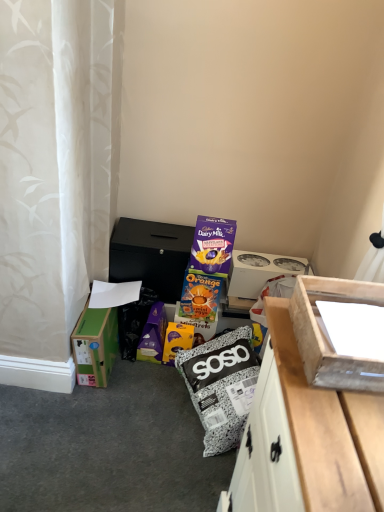
The height and width of the screenshot is (512, 384). Describe the element at coordinates (95, 345) in the screenshot. I see `green cardboard box at lower left, which appears as the 2th box when viewed from the front` at that location.

What do you see at coordinates (176, 341) in the screenshot? I see `orange cardboard box at center, which is counted as the 2th cardboard box, starting from the top` at bounding box center [176, 341].

At what (x,y) coordinates should I click in order to perform the action: click on green cardboard box at lower left, which appears as the second box when viewed from the back. Please return your answer as a coordinate pair (x, y). Looking at the image, I should click on pos(95,345).

Who is shorter, white cardboard box at upper right, which is the 3th box from front to back, or green cardboard box at lower left, which appears as the 2th box when viewed from the front?

Answer: white cardboard box at upper right, which is the 3th box from front to back.

From the image's perspective, which one is positioned lower, white cardboard box at upper right, marked as the 3th box in a left-to-right arrangement, or green cardboard box at lower left, which appears as the 3th box when viewed from the right?

green cardboard box at lower left, which appears as the 3th box when viewed from the right, appears lower in the image.

Is white cardboard box at upper right, which is the 3th box from front to back, oriented away from green cardboard box at lower left, which appears as the 2th box when viewed from the front?

No, green cardboard box at lower left, which appears as the 2th box when viewed from the front, is not at the back of white cardboard box at upper right, which is the 3th box from front to back.

There is a green cardboard box at lower left, the first box viewed from the left. At what (x,y) coordinates should I click in order to perform the action: click on the 2nd box above it (from the image's perspective). Please return your answer as a coordinate pair (x, y). The height and width of the screenshot is (512, 384). Looking at the image, I should click on (260, 271).

Is green cardboard box at lower left, which appears as the second box when viewed from the back, outside of orange cardboard box at center, the first cardboard box in the bottom-to-top sequence?

That's correct, green cardboard box at lower left, which appears as the second box when viewed from the back, is outside of orange cardboard box at center, the first cardboard box in the bottom-to-top sequence.

Does green cardboard box at lower left, which appears as the 2th box when viewed from the front, turn towards orange cardboard box at center, which is counted as the 2th cardboard box, starting from the top?

Yes, green cardboard box at lower left, which appears as the 2th box when viewed from the front, is facing orange cardboard box at center, which is counted as the 2th cardboard box, starting from the top.

Are green cardboard box at lower left, which appears as the second box when viewed from the back, and orange cardboard box at center, the first cardboard box in the bottom-to-top sequence, far apart?

No, green cardboard box at lower left, which appears as the second box when viewed from the back, is in close proximity to orange cardboard box at center, the first cardboard box in the bottom-to-top sequence.

Considering the positions of objects green cardboard box at lower left, the first box viewed from the left, and orange cardboard box at center, the first cardboard box in the bottom-to-top sequence, in the image provided, who is more to the left, green cardboard box at lower left, the first box viewed from the left, or orange cardboard box at center, the first cardboard box in the bottom-to-top sequence,?

green cardboard box at lower left, the first box viewed from the left.

In the scene shown: Is wooden box at right, arranged as the 1th box when viewed from the front, smaller than green cardboard box at lower left, which appears as the 3th box when viewed from the right?

Indeed, wooden box at right, arranged as the 1th box when viewed from the front, has a smaller size compared to green cardboard box at lower left, which appears as the 3th box when viewed from the right.

From a real-world perspective, between wooden box at right, which is counted as the second box, starting from the left, and green cardboard box at lower left, which appears as the 2th box when viewed from the front, who is vertically lower?

green cardboard box at lower left, which appears as the 2th box when viewed from the front, is physically lower.

From the image's perspective, which object appears higher, wooden box at right, arranged as the 1th box when viewed from the front, or green cardboard box at lower left, which appears as the second box when viewed from the back?

wooden box at right, arranged as the 1th box when viewed from the front, appears higher in the image.

Consider the image. Which of these two, wooden box at right, arranged as the second box when viewed from the right, or green cardboard box at lower left, which appears as the 2th box when viewed from the front, stands taller?

green cardboard box at lower left, which appears as the 2th box when viewed from the front, is taller.

From the image's perspective, is black matte box at center, marked as the first cardboard box in a top-to-bottom arrangement, located beneath green cardboard box at lower left, the first box viewed from the left?

No, from the image's perspective, black matte box at center, marked as the first cardboard box in a top-to-bottom arrangement, is not beneath green cardboard box at lower left, the first box viewed from the left.

How much distance is there between black matte box at center, the second cardboard box from the bottom, and green cardboard box at lower left, which appears as the 3th box when viewed from the right?

black matte box at center, the second cardboard box from the bottom, and green cardboard box at lower left, which appears as the 3th box when viewed from the right, are 29.92 centimeters apart.

Between black matte box at center, the second cardboard box from the bottom, and green cardboard box at lower left, the first box viewed from the left, which one appears on the right side from the viewer's perspective?

black matte box at center, the second cardboard box from the bottom.

Is black matte box at center, the second cardboard box from the bottom, located outside green cardboard box at lower left, which appears as the 3th box when viewed from the right?

Absolutely, black matte box at center, the second cardboard box from the bottom, is external to green cardboard box at lower left, which appears as the 3th box when viewed from the right.

From a real-world perspective, is green cardboard box at lower left, which appears as the 2th box when viewed from the front, on black matte box at center, marked as the first cardboard box in a top-to-bottom arrangement?

No.

Considering the relative sizes of green cardboard box at lower left, which appears as the second box when viewed from the back, and black matte box at center, marked as the first cardboard box in a top-to-bottom arrangement, in the image provided, is green cardboard box at lower left, which appears as the second box when viewed from the back, smaller than black matte box at center, marked as the first cardboard box in a top-to-bottom arrangement,?

Yes.

How much distance is there between green cardboard box at lower left, the first box viewed from the left, and black matte box at center, the second cardboard box from the bottom?

A distance of 29.92 centimeters exists between green cardboard box at lower left, the first box viewed from the left, and black matte box at center, the second cardboard box from the bottom.

Is green cardboard box at lower left, which appears as the 2th box when viewed from the front, positioned in front of black matte box at center, marked as the first cardboard box in a top-to-bottom arrangement?

Yes, green cardboard box at lower left, which appears as the 2th box when viewed from the front, is in front of black matte box at center, marked as the first cardboard box in a top-to-bottom arrangement.

Does point (266, 266) lie behind point (184, 331)?

Yes, it is.

Is white cardboard box at upper right, marked as the 3th box in a left-to-right arrangement, inside the boundaries of orange cardboard box at center, which is counted as the 2th cardboard box, starting from the top, or outside?

white cardboard box at upper right, marked as the 3th box in a left-to-right arrangement, is not inside orange cardboard box at center, which is counted as the 2th cardboard box, starting from the top, it's outside.

Considering the sizes of objects white cardboard box at upper right, marked as the 3th box in a left-to-right arrangement, and orange cardboard box at center, the first cardboard box in the bottom-to-top sequence, in the image provided, who is smaller, white cardboard box at upper right, marked as the 3th box in a left-to-right arrangement, or orange cardboard box at center, the first cardboard box in the bottom-to-top sequence,?

With smaller size is orange cardboard box at center, the first cardboard box in the bottom-to-top sequence.

Considering the relative positions of white cardboard box at upper right, marked as the 3th box in a left-to-right arrangement, and orange cardboard box at center, the first cardboard box in the bottom-to-top sequence, in the image provided, is white cardboard box at upper right, marked as the 3th box in a left-to-right arrangement, to the left or to the right of orange cardboard box at center, the first cardboard box in the bottom-to-top sequence,?

white cardboard box at upper right, marked as the 3th box in a left-to-right arrangement, is to the right of orange cardboard box at center, the first cardboard box in the bottom-to-top sequence.

Consider the image. Is wooden box at right, which is counted as the second box, starting from the left, positioned beyond the bounds of white cardboard box at upper right, which is the 3th box from front to back?

That's correct, wooden box at right, which is counted as the second box, starting from the left, is outside of white cardboard box at upper right, which is the 3th box from front to back.

Considering the sizes of objects wooden box at right, the 3th box positioned from the back, and white cardboard box at upper right, marked as the 3th box in a left-to-right arrangement, in the image provided, who is taller, wooden box at right, the 3th box positioned from the back, or white cardboard box at upper right, marked as the 3th box in a left-to-right arrangement,?

white cardboard box at upper right, marked as the 3th box in a left-to-right arrangement.

Which point is more forward, (341,382) or (245,283)?

Point (341,382)

In order to click on box that is under the white cardboard box at upper right, marked as the 3th box in a left-to-right arrangement (from a real-world perspective) in this screenshot , I will do `click(95, 345)`.

The width and height of the screenshot is (384, 512). Find the location of `box that is the 1st object located above the orange cardboard box at center, which is counted as the 2th cardboard box, starting from the top (from the image's perspective)`. box that is the 1st object located above the orange cardboard box at center, which is counted as the 2th cardboard box, starting from the top (from the image's perspective) is located at coordinates (95, 345).

Looking at the image, which one is located closer to orange cardboard box at center, which is counted as the 2th cardboard box, starting from the top, black matte box at center, marked as the first cardboard box in a top-to-bottom arrangement, or green cardboard box at lower left, which appears as the 2th box when viewed from the front?

Among the two, green cardboard box at lower left, which appears as the 2th box when viewed from the front, is located nearer to orange cardboard box at center, which is counted as the 2th cardboard box, starting from the top.

From the image, which object appears to be farther from wooden box at right, arranged as the second box when viewed from the right, white cardboard box at upper right, which is the 1th box from back to front, or black matte box at center, the second cardboard box from the bottom?

Among the two, white cardboard box at upper right, which is the 1th box from back to front, is located further to wooden box at right, arranged as the second box when viewed from the right.

Which object lies further to the anchor point wooden box at right, the 3th box positioned from the back, green cardboard box at lower left, which appears as the 2th box when viewed from the front, or black matte box at center, the second cardboard box from the bottom?

green cardboard box at lower left, which appears as the 2th box when viewed from the front, is further to wooden box at right, the 3th box positioned from the back.

Based on the photo, from the image, which object appears to be nearer to green cardboard box at lower left, which appears as the 3th box when viewed from the right, black matte box at center, the second cardboard box from the bottom, or wooden box at right, arranged as the 1th box when viewed from the front?

Among the two, black matte box at center, the second cardboard box from the bottom, is located nearer to green cardboard box at lower left, which appears as the 3th box when viewed from the right.

Which object lies further to the anchor point black matte box at center, marked as the first cardboard box in a top-to-bottom arrangement, green cardboard box at lower left, which appears as the 3th box when viewed from the right, or orange cardboard box at center, the first cardboard box in the bottom-to-top sequence?

The object further to black matte box at center, marked as the first cardboard box in a top-to-bottom arrangement, is orange cardboard box at center, the first cardboard box in the bottom-to-top sequence.

From the picture: Looking at the image, which one is located further to black matte box at center, the second cardboard box from the bottom, orange cardboard box at center, which is counted as the 2th cardboard box, starting from the top, or green cardboard box at lower left, which appears as the 3th box when viewed from the right?

The object further to black matte box at center, the second cardboard box from the bottom, is orange cardboard box at center, which is counted as the 2th cardboard box, starting from the top.

When comparing their distances from black matte box at center, marked as the first cardboard box in a top-to-bottom arrangement, does green cardboard box at lower left, which appears as the 3th box when viewed from the right, or wooden box at right, which is counted as the second box, starting from the left, seem closer?

Among the two, green cardboard box at lower left, which appears as the 3th box when viewed from the right, is located nearer to black matte box at center, marked as the first cardboard box in a top-to-bottom arrangement.

From the image, which object appears to be farther from orange cardboard box at center, the first cardboard box in the bottom-to-top sequence, black matte box at center, marked as the first cardboard box in a top-to-bottom arrangement, or white cardboard box at upper right, marked as the 3th box in a left-to-right arrangement?

white cardboard box at upper right, marked as the 3th box in a left-to-right arrangement, is positioned further to the anchor orange cardboard box at center, the first cardboard box in the bottom-to-top sequence.

Find the location of a particular element. box positioned between wooden box at right, arranged as the second box when viewed from the right, and orange cardboard box at center, the first cardboard box in the bottom-to-top sequence, from near to far is located at coordinates (95, 345).

Find the location of a particular element. Image resolution: width=384 pixels, height=512 pixels. cardboard box situated between black matte box at center, the second cardboard box from the bottom, and white cardboard box at upper right, marked as the 3th box in a left-to-right arrangement, from left to right is located at coordinates (176, 341).

Locate an element on the screen. The width and height of the screenshot is (384, 512). box between wooden box at right, arranged as the second box when viewed from the right, and white cardboard box at upper right, marked as the 3th box in a left-to-right arrangement, from front to back is located at coordinates (95, 345).

Identify the location of cardboard box between wooden box at right, which is counted as the second box, starting from the left, and black matte box at center, the second cardboard box from the bottom, along the z-axis. (176, 341).